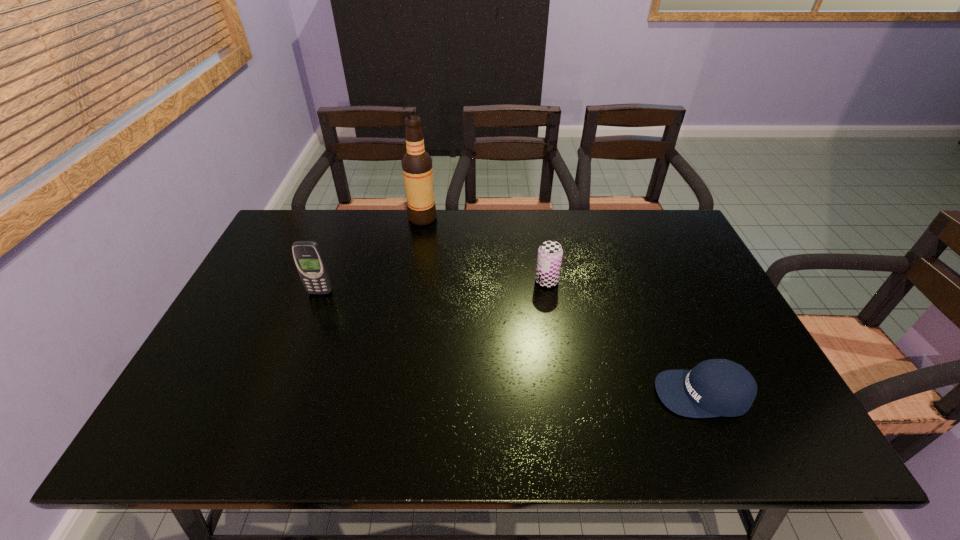
The image size is (960, 540). What are the coordinates of `free space between the second nearest object and the beer can` in the screenshot? It's located at (433, 287).

What are the coordinates of `unoccupied position between the second shortest object and the tallest object` in the screenshot? It's located at (485, 249).

Identify the location of vacant space that is in between the second object from right to left and the nearest object. The width and height of the screenshot is (960, 540). (625, 338).

At what (x,y) coordinates should I click in order to perform the action: click on free spot between the second shortest object and the shortest object. Please return your answer as a coordinate pair (x, y). Looking at the image, I should click on (625, 338).

Identify the location of free spot between the rightmost object and the third shortest object. (512, 343).

Identify which object is the second nearest to the second object from right to left. Please provide its 2D coordinates. Your answer should be formatted as a tuple, i.e. [(x, y)], where the tuple contains the x and y coordinates of a point satisfying the conditions above.

[(417, 169)]

Identify the location of object that is the second closest to the shortest object. (417, 169).

Find the location of `free space that satisfies the following two spatial constraints: 1. on the back side of the beer can; 2. on the label of the farthest object`. free space that satisfies the following two spatial constraints: 1. on the back side of the beer can; 2. on the label of the farthest object is located at coordinates (537, 218).

Locate an element on the screen. Image resolution: width=960 pixels, height=540 pixels. free space that satisfies the following two spatial constraints: 1. on the label of the alcohol; 2. on the back side of the third object from left to right is located at coordinates click(x=412, y=281).

I want to click on free location that satisfies the following two spatial constraints: 1. on the label of the farthest object; 2. on the screen of the third shortest object, so pyautogui.click(x=410, y=292).